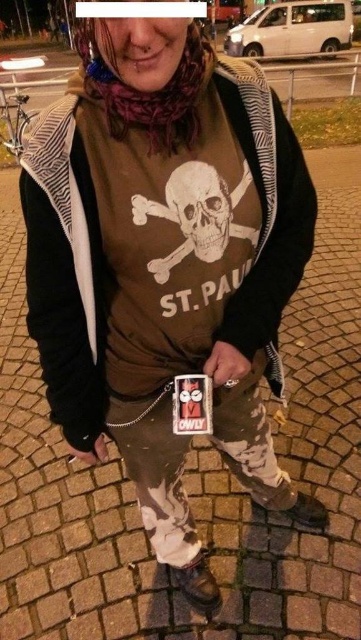
Question: Is brown cotton sweatshirt at center behind matte brown skull at center?

Choices:
 (A) no
 (B) yes

Answer: (A)

Question: Which is farther from the matte brown skull at center?

Choices:
 (A) white matte skull at center
 (B) brown cotton sweatshirt at center

Answer: (B)

Question: In this image, where is matte brown skull at center located relative to white matte skull at center?

Choices:
 (A) left
 (B) right

Answer: (B)

Question: Estimate the real-world distances between objects in this image. Which object is farther from the matte brown skull at center?

Choices:
 (A) white matte skull at center
 (B) brown cotton sweatshirt at center

Answer: (B)

Question: Which of the following is the farthest from the observer?

Choices:
 (A) (68, 305)
 (B) (209, 257)
 (C) (174, 180)

Answer: (A)

Question: Is brown cotton sweatshirt at center to the left of white matte skull at center from the viewer's perspective?

Choices:
 (A) no
 (B) yes

Answer: (A)